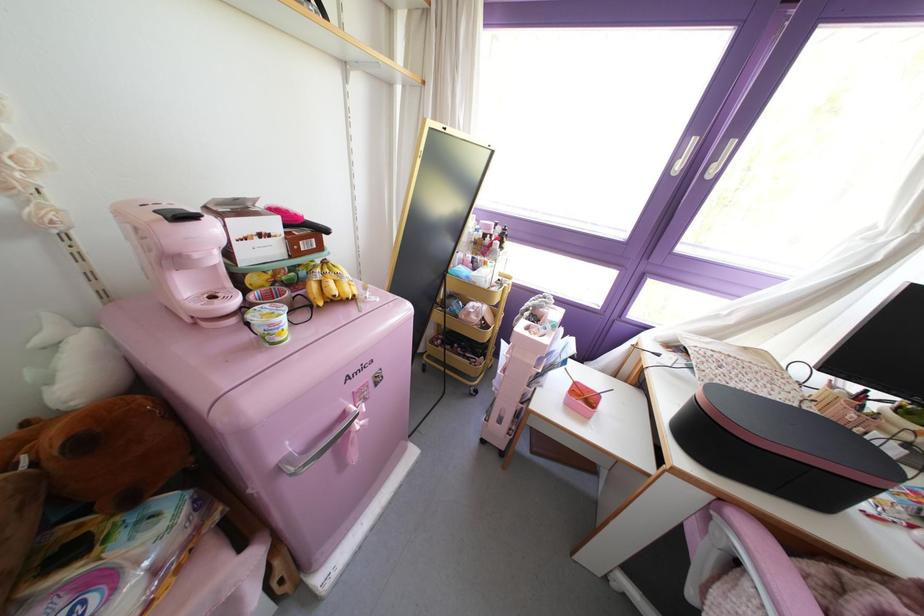
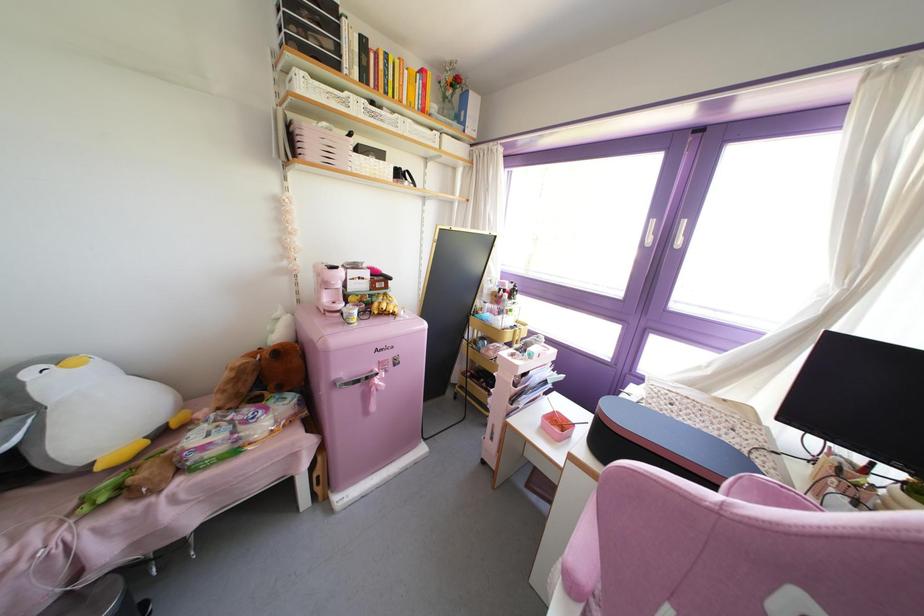
Find the pixel in the second image that matches (x=693, y=140) in the first image.

(652, 222)